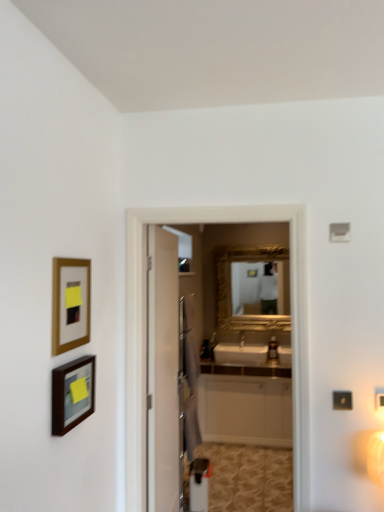
Question: Is the depth of white glossy cabinet at center greater than that of matte black picture frame at lower left, which ranks as the 2th picture frame in top-to-bottom order?

Choices:
 (A) no
 (B) yes

Answer: (B)

Question: Is white glossy cabinet at center not close to matte black picture frame at lower left, which ranks as the 2th picture frame in top-to-bottom order?

Choices:
 (A) no
 (B) yes

Answer: (B)

Question: Considering the relative positions of white glossy cabinet at center and matte black picture frame at lower left, arranged as the first picture frame when ordered from the bottom, in the image provided, is white glossy cabinet at center to the left of matte black picture frame at lower left, arranged as the first picture frame when ordered from the bottom, from the viewer's perspective?

Choices:
 (A) yes
 (B) no

Answer: (B)

Question: Can you confirm if white glossy cabinet at center is shorter than matte black picture frame at lower left, arranged as the first picture frame when ordered from the bottom?

Choices:
 (A) yes
 (B) no

Answer: (B)

Question: From the image's perspective, is white glossy cabinet at center located beneath matte black picture frame at lower left, which ranks as the 2th picture frame in top-to-bottom order?

Choices:
 (A) no
 (B) yes

Answer: (B)

Question: Can you confirm if white glossy cabinet at center is thinner than matte black picture frame at lower left, arranged as the first picture frame when ordered from the bottom?

Choices:
 (A) no
 (B) yes

Answer: (A)

Question: From a real-world perspective, does gold-framed picture at left, which is counted as the 1th picture frame, starting from the top, sit lower than white glossy cabinet at center?

Choices:
 (A) no
 (B) yes

Answer: (A)

Question: Is gold-framed picture at left, which is counted as the 1th picture frame, starting from the top, oriented away from white glossy cabinet at center?

Choices:
 (A) no
 (B) yes

Answer: (A)

Question: Does gold-framed picture at left, which is counted as the 2th picture frame, starting from the bottom, have a greater width compared to white glossy cabinet at center?

Choices:
 (A) yes
 (B) no

Answer: (B)

Question: Does gold-framed picture at left, which is counted as the 1th picture frame, starting from the top, have a lesser width compared to white glossy cabinet at center?

Choices:
 (A) yes
 (B) no

Answer: (A)

Question: Could you tell me if gold-framed picture at left, which is counted as the 1th picture frame, starting from the top, is turned towards white glossy cabinet at center?

Choices:
 (A) no
 (B) yes

Answer: (A)

Question: Is white glossy cabinet at center surrounded by gold-framed picture at left, which is counted as the 2th picture frame, starting from the bottom?

Choices:
 (A) yes
 (B) no

Answer: (B)

Question: Is gold-framed picture at left, which is counted as the 1th picture frame, starting from the top, looking in the opposite direction of matte black picture frame at lower left, arranged as the first picture frame when ordered from the bottom?

Choices:
 (A) no
 (B) yes

Answer: (A)